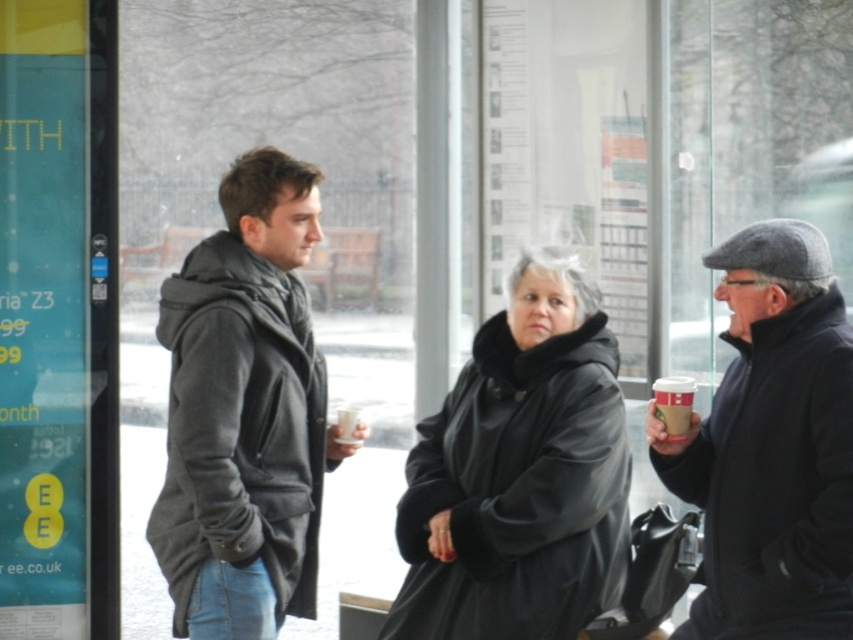
Is white paper cup at right thinner than white paper cup at center?

Incorrect, white paper cup at right's width is not less than white paper cup at center's.

Does white paper cup at right appear over white paper cup at center?

Yes, white paper cup at right is above white paper cup at center.

The width and height of the screenshot is (853, 640). I want to click on white paper cup at right, so click(672, 404).

Does black leather coat at center have a lesser height compared to white paper cup at center?

Incorrect, black leather coat at center's height does not fall short of white paper cup at center's.

Can you confirm if black leather coat at center is positioned below white paper cup at center?

Yes.

Is point (463, 588) less distant than point (344, 406)?

Yes, it is.

Find the location of `black leather coat at center`. black leather coat at center is located at coordinates (520, 474).

The height and width of the screenshot is (640, 853). Find the location of `matte black jacket at right`. matte black jacket at right is located at coordinates (772, 445).

Who is more forward, (715, 524) or (685, 424)?

Point (715, 524)

Measure the distance between matte black jacket at right and camera.

They are 13.93 feet apart.

This screenshot has height=640, width=853. I want to click on matte black jacket at right, so click(x=772, y=445).